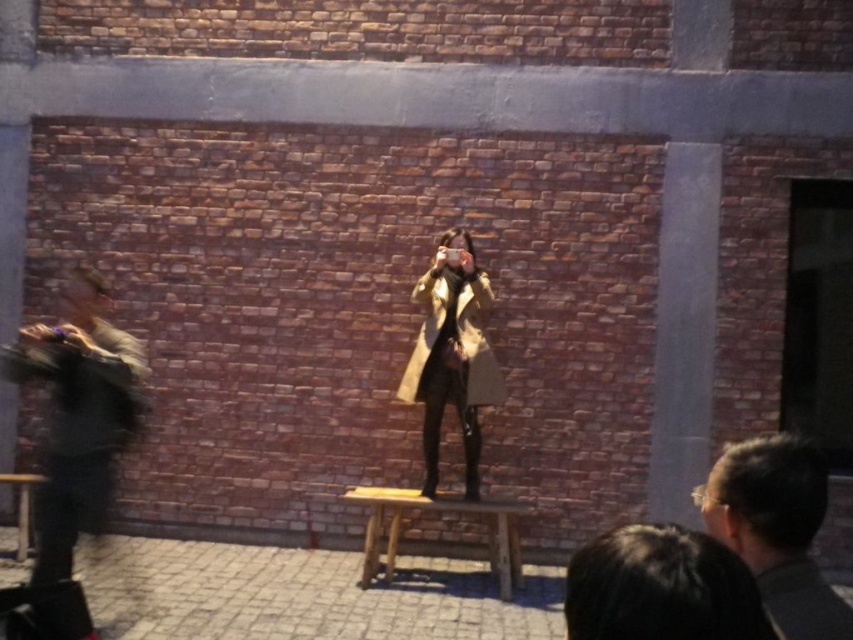
Does dark gray fur coat at left have a smaller size compared to dark brown hair at center?

Incorrect, dark gray fur coat at left is not smaller in size than dark brown hair at center.

Consider the image. Is the position of dark gray fur coat at left more distant than that of dark brown hair at center?

Yes, dark gray fur coat at left is behind dark brown hair at center.

What do you see at coordinates (79, 416) in the screenshot? This screenshot has width=853, height=640. I see `dark gray fur coat at left` at bounding box center [79, 416].

Where is `dark gray fur coat at left`? The height and width of the screenshot is (640, 853). dark gray fur coat at left is located at coordinates (79, 416).